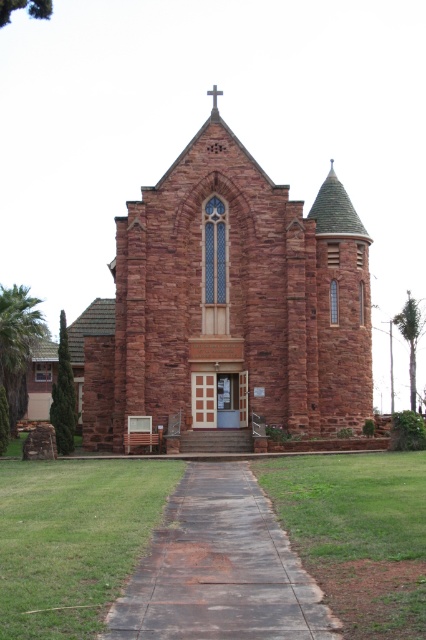
You are standing in front of the church and see two points marked on the building. The first point is at coordinates point (213, 372) and the second is at point (256, 627). Which point is closer to you?

Point (213, 372) is further to the camera than point (256, 627), so the point closer to you is point (256, 627).